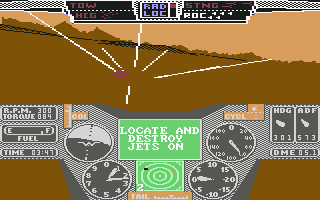
At what (x,y) coordinates should I click in order to perform the action: click on display. Please return your answer as a coordinate pair (x, y). This screenshot has width=320, height=200. Looking at the image, I should click on (101, 118).